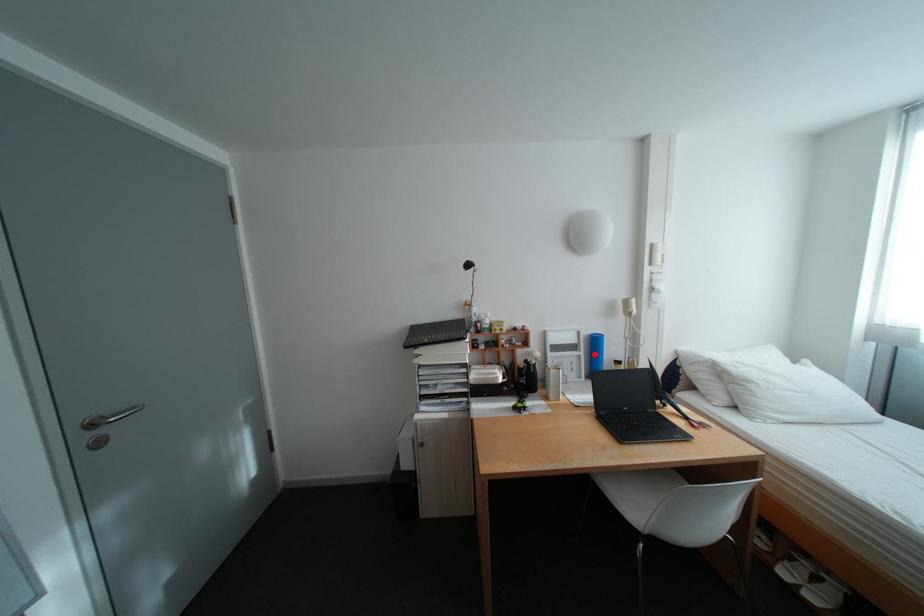
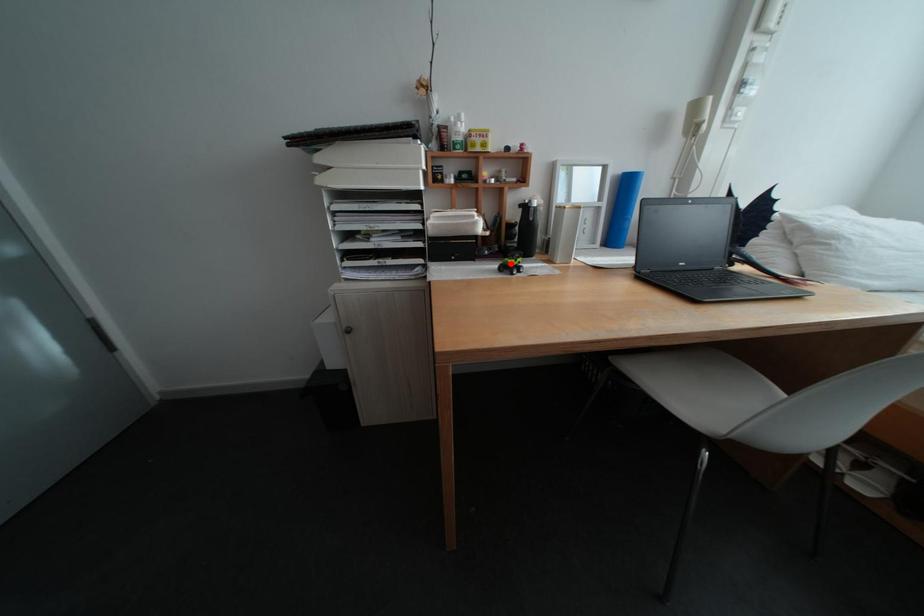
I am providing you with two images of the same scene from different viewpoints. A red point is marked on the first image and another point is marked on the second image. Is the marked point in image1 the same physical position as the marked point in image2?

No